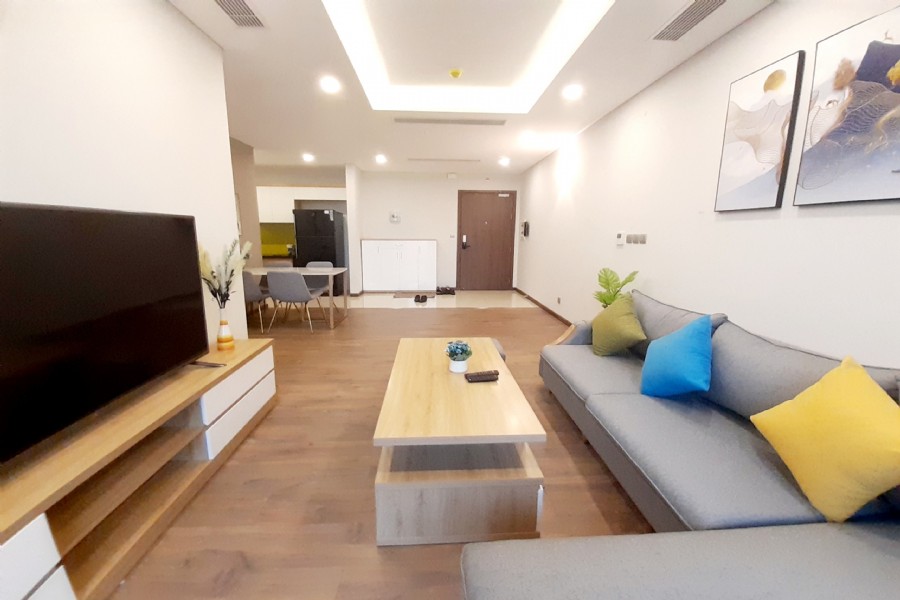
You are a GUI agent. You are given a task and a screenshot of the screen. Output one action in this format:
    pyautogui.click(x=<x>, y=<y>)
    Task: Click on the top shelf of television stand
    
    Given the screenshot: What is the action you would take?
    pyautogui.click(x=118, y=430)